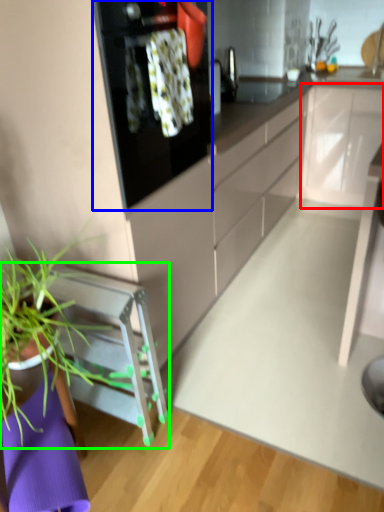
Question: Which is farther away from cabinetry (highlighted by a red box)? kitchen appliance (highlighted by a blue box) or furniture (highlighted by a green box)?

Choices:
 (A) kitchen appliance
 (B) furniture

Answer: (B)